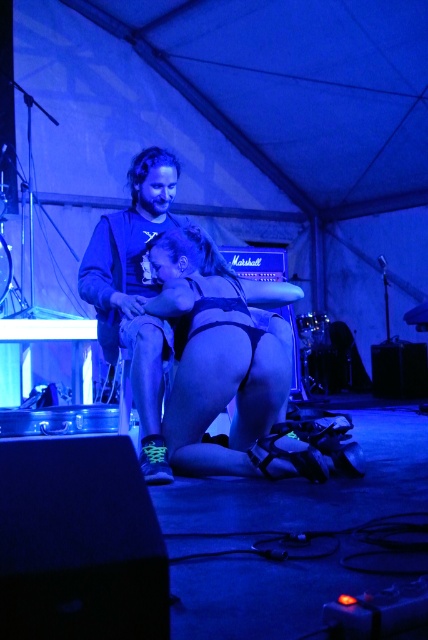
Question: Among these points, which one is nearest to the camera?

Choices:
 (A) (234, 324)
 (B) (121, 285)

Answer: (A)

Question: Which of the following is the farthest from the observer?

Choices:
 (A) matte black shirt at center
 (B) black matte bikini bottom at center

Answer: (A)

Question: Does black matte bikini bottom at center have a lesser width compared to matte black shirt at center?

Choices:
 (A) yes
 (B) no

Answer: (B)

Question: From the image, what is the correct spatial relationship of black matte bikini bottom at center in relation to matte black shirt at center?

Choices:
 (A) above
 (B) below

Answer: (B)

Question: Does black matte bikini bottom at center appear over matte black shirt at center?

Choices:
 (A) yes
 (B) no

Answer: (B)